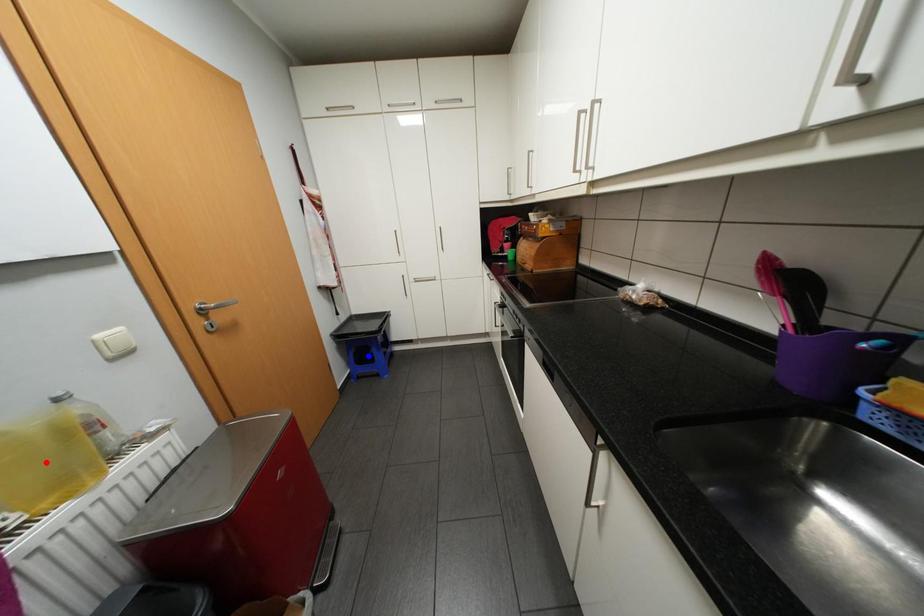
Question: In the image, two points are highlighted. Which point is nearer to the camera? Reply with the corresponding letter.

Choices:
 (A) blue point
 (B) red point

Answer: (B)